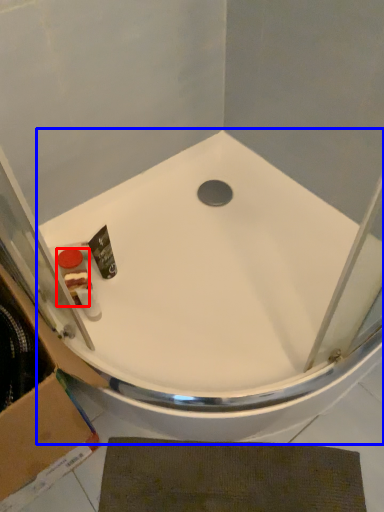
Question: Which object is further to the camera taking this photo, toiletry (highlighted by a red box) or bathtub (highlighted by a blue box)?

Choices:
 (A) toiletry
 (B) bathtub

Answer: (A)